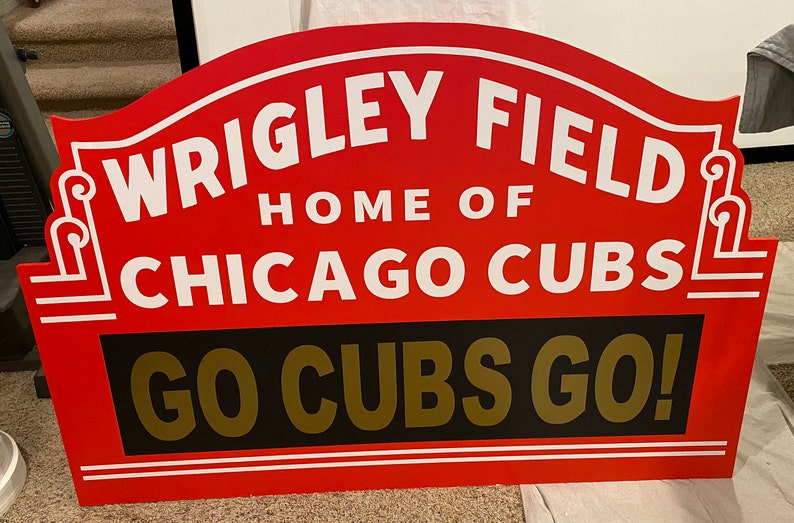
Find the location of `wall`. wall is located at coordinates (683, 46).